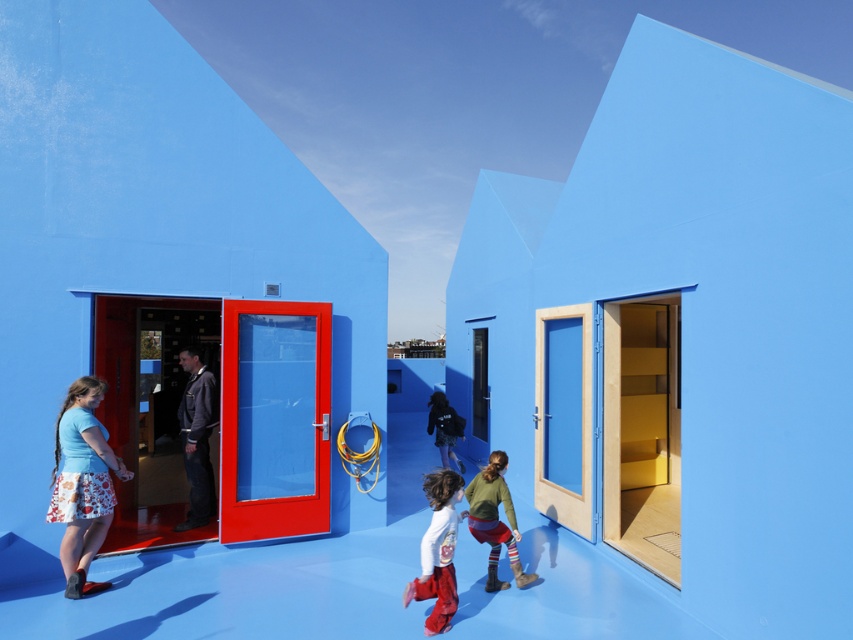
Question: Which point is closer to the camera?

Choices:
 (A) (485, 502)
 (B) (106, 522)

Answer: (A)

Question: Observing the image, what is the correct spatial positioning of green knitted sweater at center in reference to matte black jacket at center?

Choices:
 (A) left
 (B) right

Answer: (B)

Question: Which object appears farthest from the camera in this image?

Choices:
 (A) green knitted sweater at center
 (B) floral cotton skirt at lower left
 (C) matte black jacket at center
 (D) matte white shirt at center

Answer: (C)

Question: Which point is farther to the camera?

Choices:
 (A) matte white shirt at center
 (B) matte black jacket at center
 (C) green knitted sweater at center

Answer: (B)

Question: Is green knitted sweater at center to the right of matte black jacket at center from the viewer's perspective?

Choices:
 (A) no
 (B) yes

Answer: (B)

Question: Does green knitted sweater at center appear over matte black jacket at center?

Choices:
 (A) yes
 (B) no

Answer: (B)